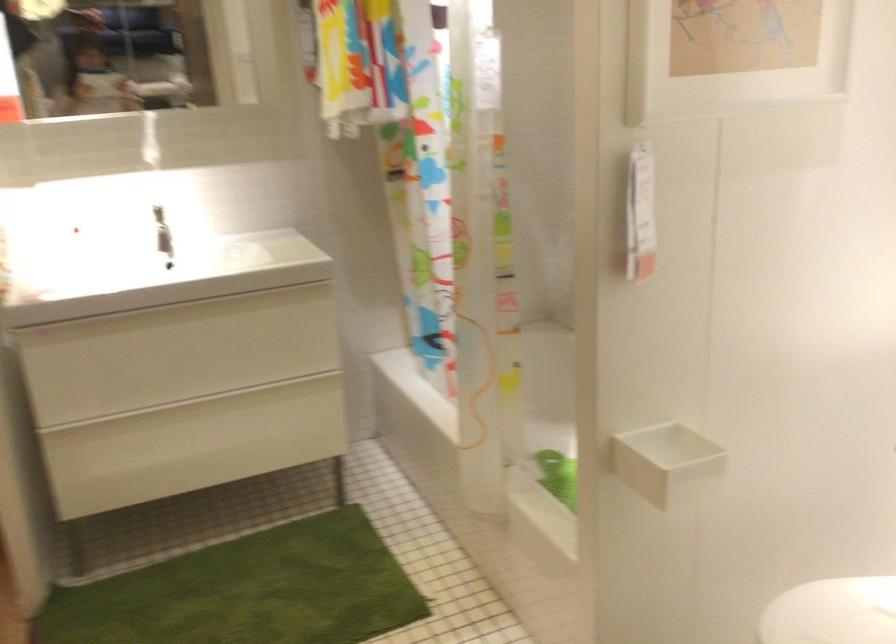
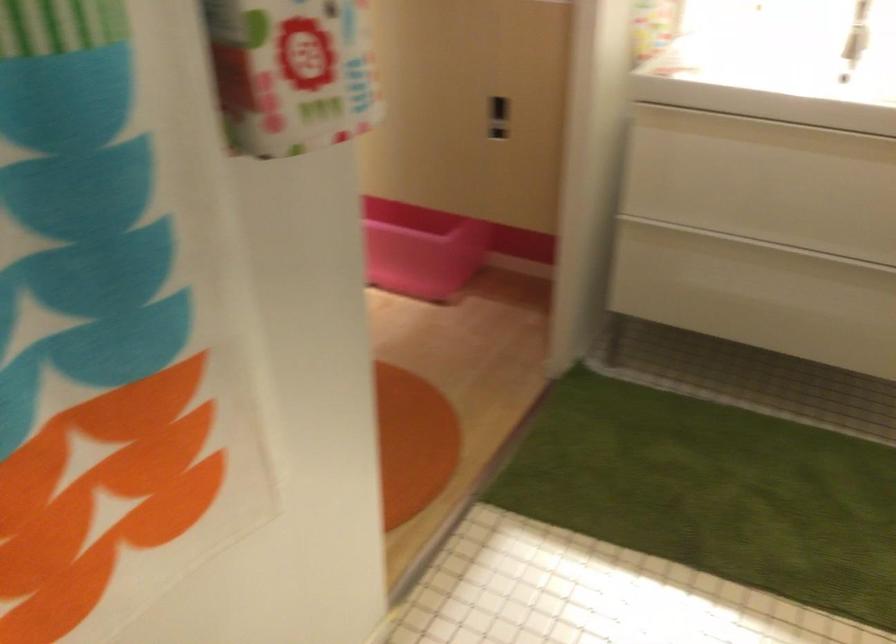
The point at (147, 327) is marked in the first image. Where is the corresponding point in the second image?

(764, 131)